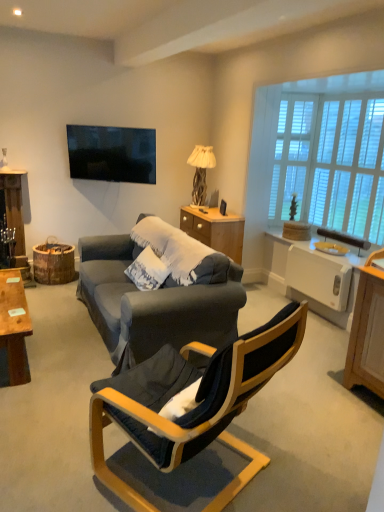
Find the location of a particular element. The height and width of the screenshot is (512, 384). free area below velvet dark blue chair at center (from a real-world perspective) is located at coordinates (196, 477).